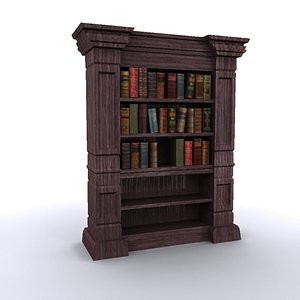
I want to click on shelves, so click(x=175, y=219), click(x=172, y=191), click(x=162, y=154), click(x=167, y=126), click(x=165, y=81).